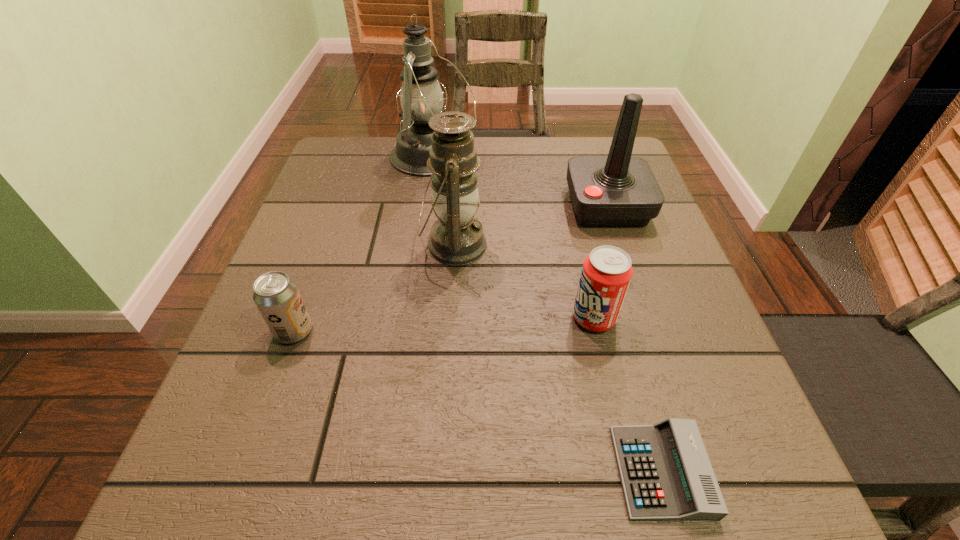
The image size is (960, 540). I want to click on the farther oil lamp, so click(x=421, y=97).

Where is `the farthest object`? This screenshot has width=960, height=540. the farthest object is located at coordinates (421, 97).

The height and width of the screenshot is (540, 960). What are the coordinates of `the nearer oil lamp` in the screenshot? It's located at (457, 238).

The height and width of the screenshot is (540, 960). In order to click on joystick in this screenshot , I will do `click(619, 190)`.

Find the location of `soda can`. soda can is located at coordinates (607, 271).

At what (x,y) coordinates should I click in order to perform the action: click on the second shortest object. Please return your answer as a coordinate pair (x, y). Looking at the image, I should click on (276, 295).

You are a GUI agent. You are given a task and a screenshot of the screen. Output one action in this format:
    pyautogui.click(x=<x>, y=<y>)
    Task: Click on the beer can
    The width and height of the screenshot is (960, 540).
    Given the screenshot: What is the action you would take?
    pyautogui.click(x=276, y=295)

Identify the location of calculator. (666, 474).

Identify the location of the shortest object. The height and width of the screenshot is (540, 960). (666, 474).

Where is `free space located on the front of the taller oil lamp`? This screenshot has width=960, height=540. free space located on the front of the taller oil lamp is located at coordinates (422, 237).